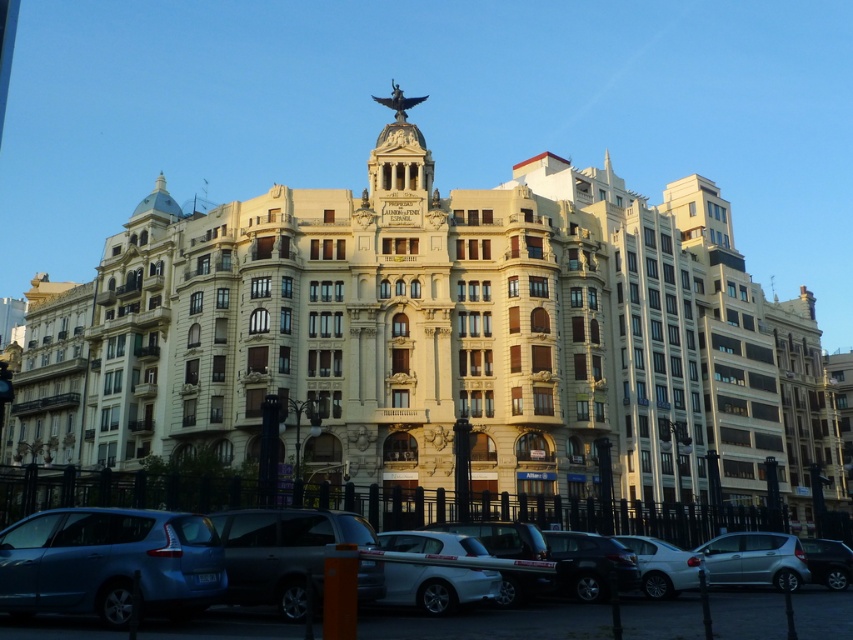
Is satin blue minivan at lower left below matte black van at center?

No, satin blue minivan at lower left is not below matte black van at center.

Who is more forward, [189,547] or [322,538]?

Point [189,547]

From the picture: Measure the distance between point (219, 556) and camera.

A distance of 115.51 feet exists between point (219, 556) and camera.

Where is `satin blue minivan at lower left`? The image size is (853, 640). satin blue minivan at lower left is located at coordinates (109, 563).

Between satin silver car at lower right and matte black car at lower right, which one appears on the right side from the viewer's perspective?

matte black car at lower right is more to the right.

Does satin silver car at lower right appear over matte black car at lower right?

Yes.

The width and height of the screenshot is (853, 640). What are the coordinates of `satin silver car at lower right` in the screenshot? It's located at (755, 560).

Identify the location of satin silver car at lower right. The height and width of the screenshot is (640, 853). (755, 560).

Describe the element at coordinates (109, 563) in the screenshot. The width and height of the screenshot is (853, 640). I see `satin blue minivan at lower left` at that location.

Is satin blue minivan at lower left closer to camera compared to matte black car at lower right?

Yes, it is in front of matte black car at lower right.

This screenshot has width=853, height=640. Describe the element at coordinates (109, 563) in the screenshot. I see `satin blue minivan at lower left` at that location.

Locate an element on the screen. The height and width of the screenshot is (640, 853). satin blue minivan at lower left is located at coordinates (109, 563).